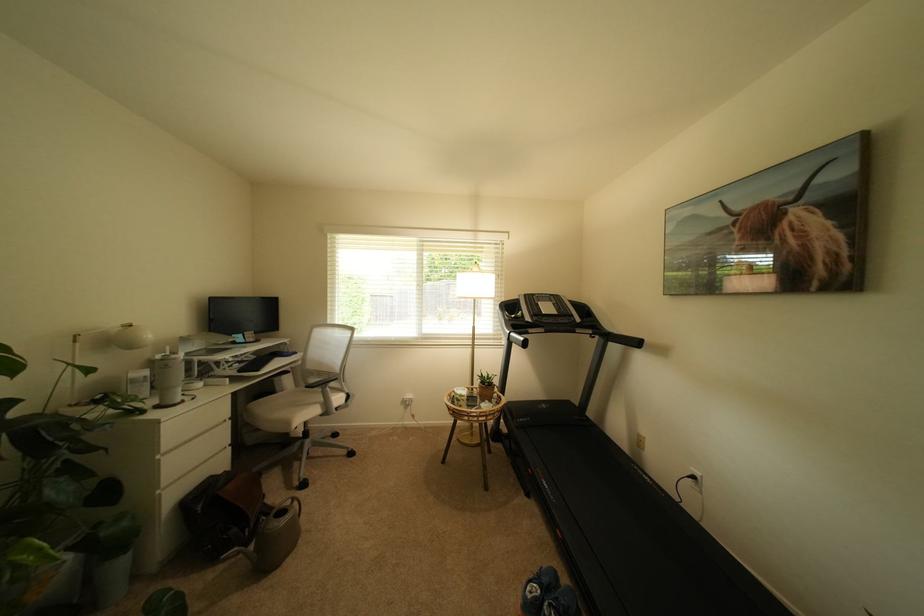
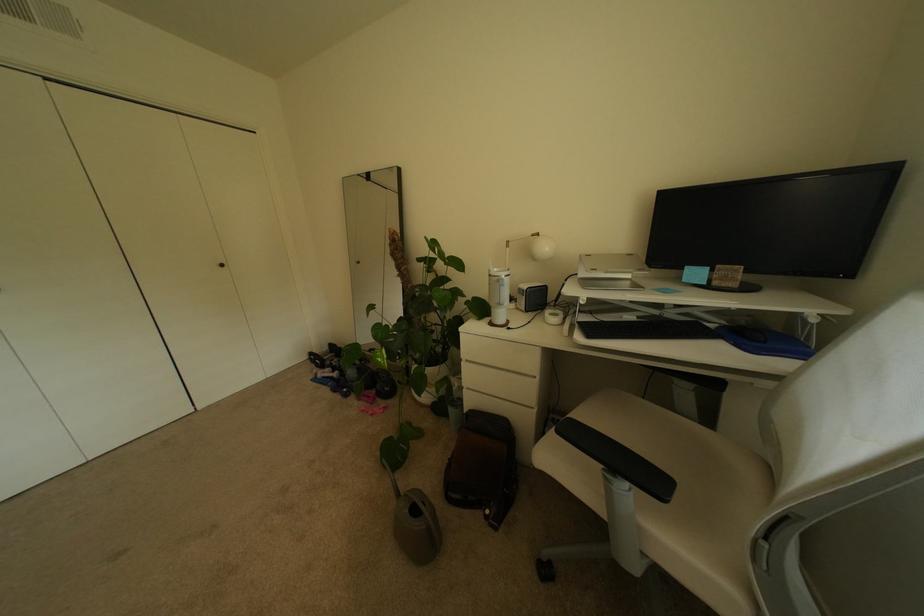
Find the pixel in the second image that matches point 213,352 in the first image.

(637, 284)